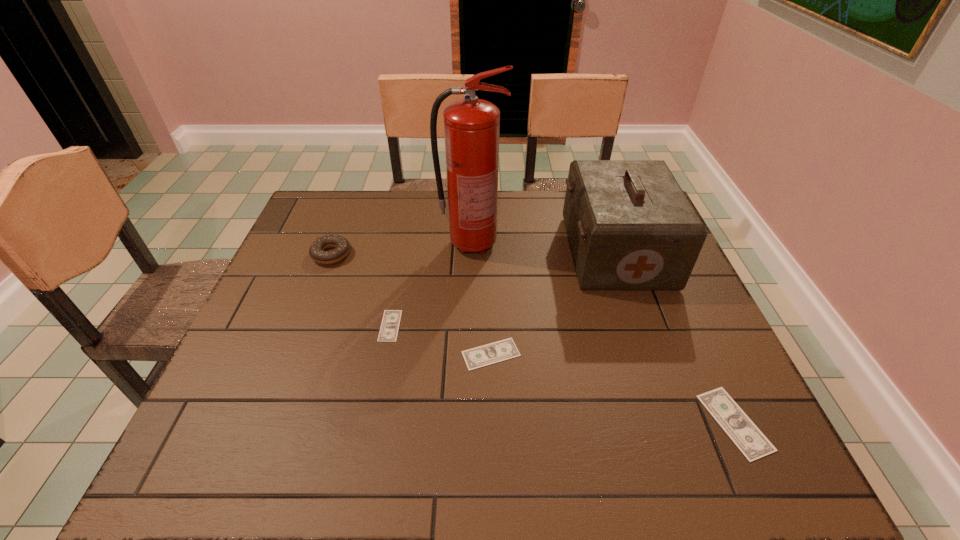
Identify the location of free spot between the leftmost object and the second money from left to right. The width and height of the screenshot is (960, 540). (411, 305).

At what (x,y) coordinates should I click in order to perform the action: click on vacant area that lies between the second tallest object and the shortest money. Please return your answer as a coordinate pair (x, y). This screenshot has height=540, width=960. Looking at the image, I should click on (503, 289).

You are a GUI agent. You are given a task and a screenshot of the screen. Output one action in this format:
    pyautogui.click(x=<x>, y=<y>)
    Task: Click on the free space between the leftmost object and the second money from right to left
    Image resolution: width=960 pixels, height=540 pixels.
    Given the screenshot: What is the action you would take?
    pyautogui.click(x=411, y=305)

This screenshot has width=960, height=540. Identify the location of unoccupied position between the shortest money and the fire extinguisher. (431, 285).

The width and height of the screenshot is (960, 540). Identify the location of vacant region between the fire extinguisher and the second money from right to left. (481, 299).

Identify the location of free space that is in between the tallest object and the fourth shortest object. This screenshot has width=960, height=540. (401, 249).

I want to click on free space between the fire extinguisher and the second tallest object, so click(x=543, y=248).

I want to click on empty space between the fire extinguisher and the third tallest object, so click(x=401, y=249).

Find the location of a particular element. This screenshot has width=960, height=540. vacant point located between the leftmost object and the fifth shortest object is located at coordinates (473, 253).

You are a GUI agent. You are given a task and a screenshot of the screen. Output one action in this format:
    pyautogui.click(x=<x>, y=<y>)
    Task: Click on the vacant space in between the shortest object and the fire extinguisher
    
    Given the screenshot: What is the action you would take?
    pyautogui.click(x=431, y=285)